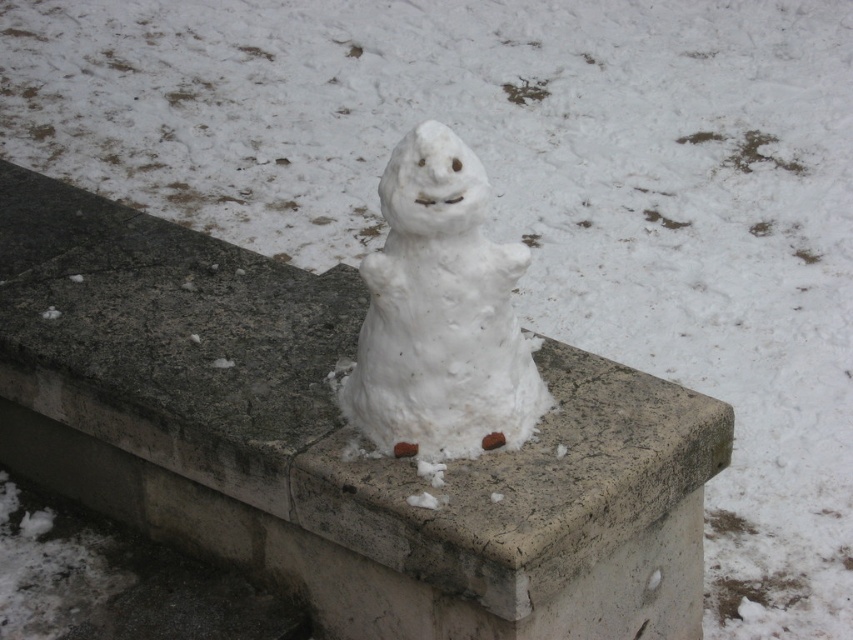
You are a delivery drone flying over the scene. You need to land on the surface that is higher between the concrete at center and the white matte snowman at center. Which surface should you choose?

The concrete at center has a greater height compared to the white matte snowman at center, so you should land on the concrete at center.

You are standing in front of the snowman on the concrete ledge. If you were to place a small marker at the coordinates point (x=331, y=440), what material would the marker be touching?

The point (x=331, y=440) corresponds to concrete at center, so the marker would be touching concrete.

You are a delivery robot that needs to place a small package on the concrete at center. The white matte snowman at center is in the way. Can you move the snowman to the side to make space?

The concrete at center is bigger than the white matte snowman at center, so there is enough space to move the snowman aside and place the package without disturbing it.